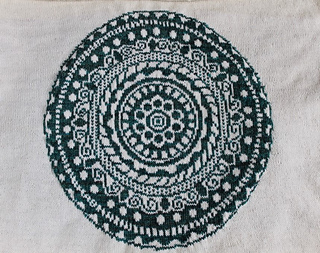
You are a GUI agent. You are given a task and a screenshot of the screen. Output one action in this format:
    pyautogui.click(x=<x>, y=<y>)
    Task: Click on the white cloth background
    The height and width of the screenshot is (253, 320).
    Given the screenshot: What is the action you would take?
    pyautogui.click(x=26, y=72)